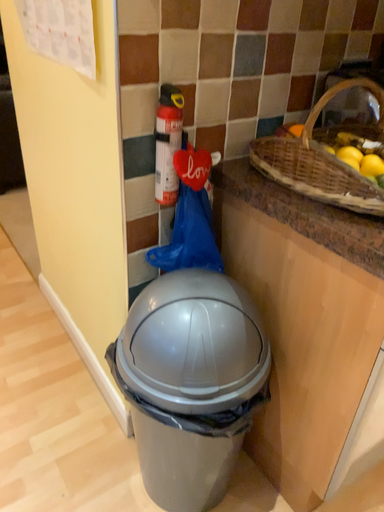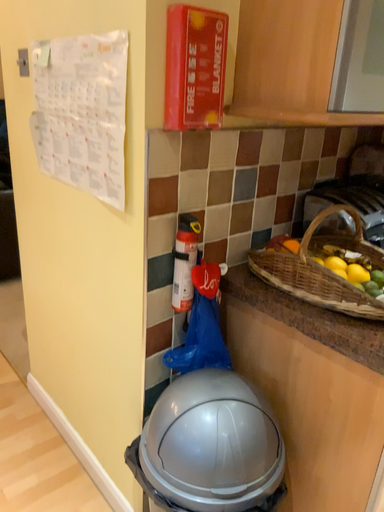
Question: How did the camera likely rotate when shooting the video?

Choices:
 (A) rotated downward
 (B) rotated upward

Answer: (B)